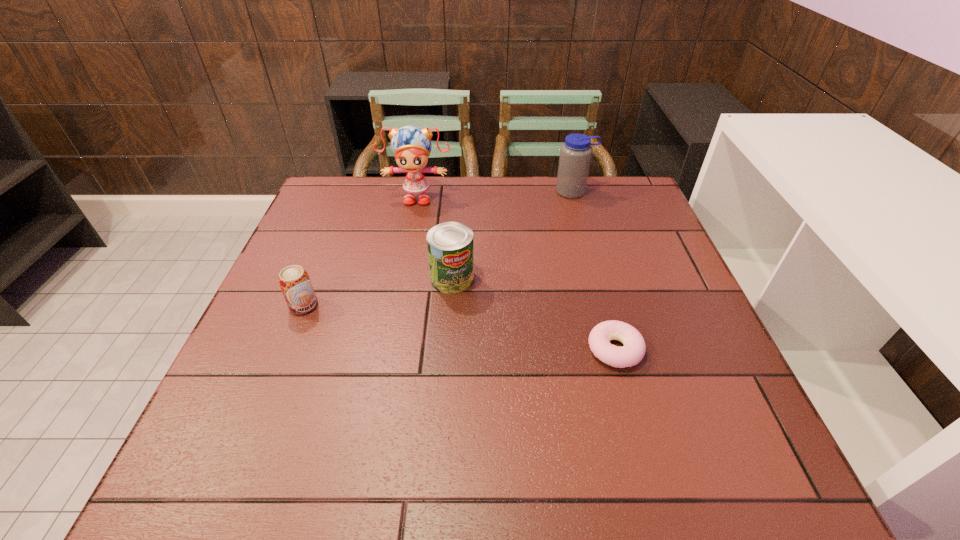
Identify the location of free space between the nearest object and the water bottle. (594, 271).

Where is `empty location between the can and the beer can`? The height and width of the screenshot is (540, 960). empty location between the can and the beer can is located at coordinates (378, 292).

Where is `free point between the third farthest object and the second tallest object`? free point between the third farthest object and the second tallest object is located at coordinates (513, 235).

The width and height of the screenshot is (960, 540). What are the coordinates of `free spot between the doughnut and the leftmost object` in the screenshot? It's located at (460, 328).

The height and width of the screenshot is (540, 960). Identify the location of free space between the doll and the fourth tallest object. (360, 251).

The height and width of the screenshot is (540, 960). I want to click on unoccupied area between the shortest object and the tallest object, so click(x=516, y=273).

Locate an element on the screen. object that stands as the third closest to the fourth farthest object is located at coordinates (x=633, y=351).

The image size is (960, 540). Find the location of `object that is the nearest to the water bottle`. object that is the nearest to the water bottle is located at coordinates (411, 145).

Where is `vacant space that satisfies the following two spatial constraints: 1. on the face of the nearest object; 2. on the left side of the tallest object`? This screenshot has height=540, width=960. vacant space that satisfies the following two spatial constraints: 1. on the face of the nearest object; 2. on the left side of the tallest object is located at coordinates (388, 349).

Where is `vacant space that satisfies the following two spatial constraints: 1. on the face of the doll; 2. on the right side of the third shortest object`? This screenshot has width=960, height=540. vacant space that satisfies the following two spatial constraints: 1. on the face of the doll; 2. on the right side of the third shortest object is located at coordinates (401, 278).